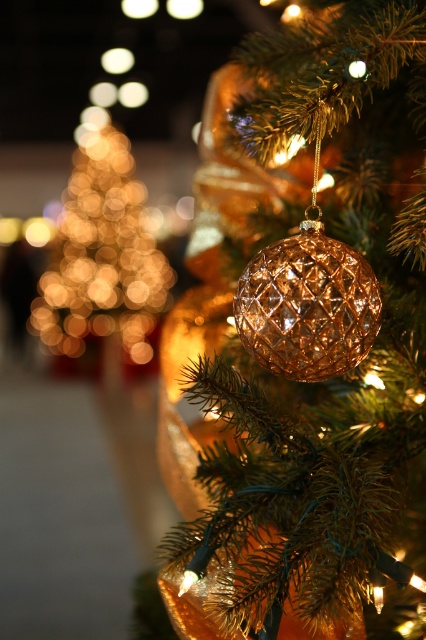
Is shiny gold ornament at center thinner than gold textured ball at center?

In fact, shiny gold ornament at center might be wider than gold textured ball at center.

Measure the distance from shiny gold ornament at center to gold textured ball at center.

9.62 inches

Is point (233, 104) behind point (302, 260)?

Yes, it is behind point (302, 260).

You are a GUI agent. You are given a task and a screenshot of the screen. Output one action in this format:
    pyautogui.click(x=<x>, y=<y>)
    Task: Click on the shiny gold ornament at center
    Image resolution: width=426 pixels, height=640 pixels.
    Given the screenshot: What is the action you would take?
    pyautogui.click(x=299, y=332)